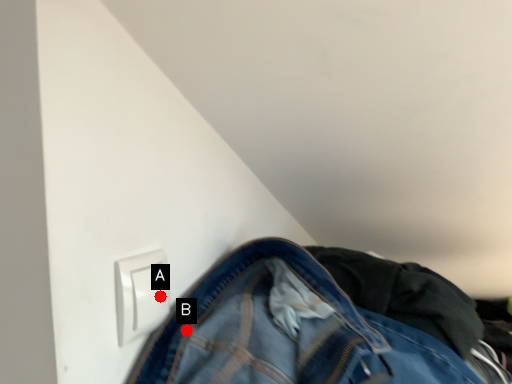
Question: Two points are circled on the image, labeled by A and B beside each circle. Which point appears farthest from the camera in this image?

Choices:
 (A) A is further
 (B) B is further

Answer: (B)